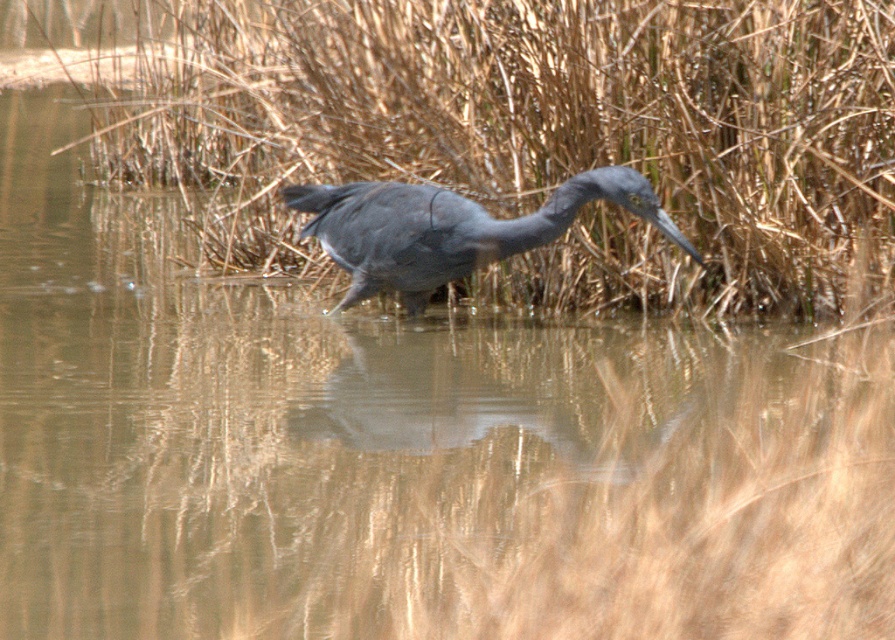
You are standing in the wetland scene and want to walk from point A to point B. Point A is at coordinates point(500, 291) and point B is at point(522, 218). Which point is closer to you?

Point A at point(500, 291) is closer to you than point B at point(522, 218) because it is further to the viewer.